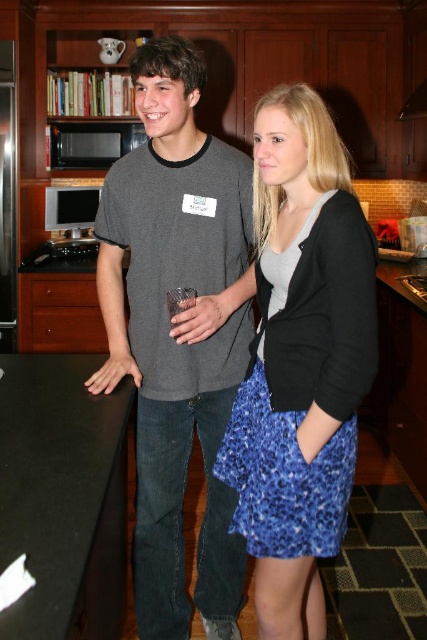
Question: Estimate the real-world distances between objects in this image. Which object is closer to the blue floral skirt at center?

Choices:
 (A) black laminate counter top at left
 (B) dark gray t-shirt at center

Answer: (B)

Question: Based on their relative distances, which object is farther from the black laminate counter top at left?

Choices:
 (A) dark gray t-shirt at center
 (B) blue floral skirt at center
 (C) black matte exhaust hood at upper center

Answer: (C)

Question: Can you confirm if dark gray t-shirt at center is smaller than black laminate counter top at left?

Choices:
 (A) yes
 (B) no

Answer: (A)

Question: Can you confirm if dark gray t-shirt at center is thinner than black laminate counter top at left?

Choices:
 (A) yes
 (B) no

Answer: (A)

Question: Is dark gray t-shirt at center further to camera compared to black matte exhaust hood at upper center?

Choices:
 (A) yes
 (B) no

Answer: (B)

Question: Which point appears farthest from the camera in this image?

Choices:
 (A) (421, 100)
 (B) (219, 200)

Answer: (A)